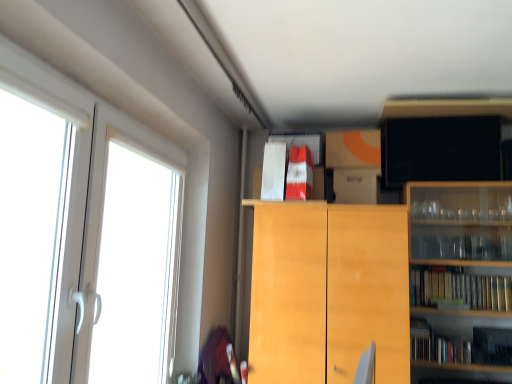
The height and width of the screenshot is (384, 512). Identify the location of vacant space situated above hardcover books at right, which appears as the 1th book when ordered from the bottom (from a real-world perspective). (474, 273).